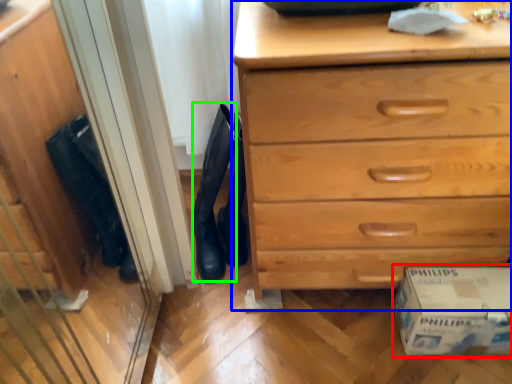
Question: Estimate the real-world distances between objects in this image. Which object is farther from cardboard box (highlighted by a red box), chest of drawers (highlighted by a blue box) or boot (highlighted by a green box)?

Choices:
 (A) chest of drawers
 (B) boot

Answer: (B)